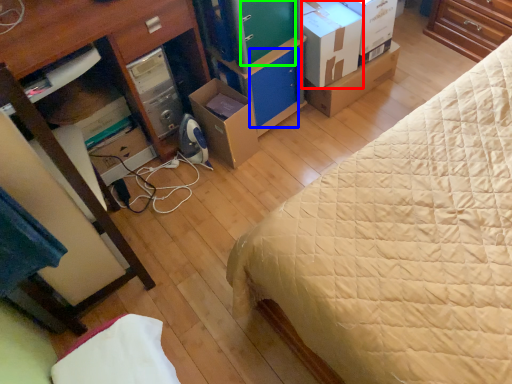
Question: Which is nearer to the cardboard box (highlighted by a red box)? drawer (highlighted by a blue box) or drawer (highlighted by a green box).

Choices:
 (A) drawer
 (B) drawer

Answer: (B)